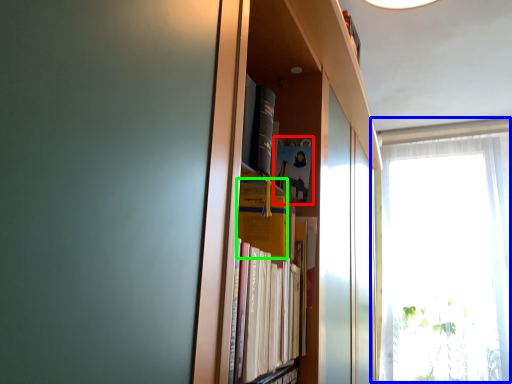
Question: Which object is positioned farthest from paperback book (highlighted by a red box)? Select from window (highlighted by a blue box) and paperback book (highlighted by a green box).

Choices:
 (A) window
 (B) paperback book

Answer: (A)